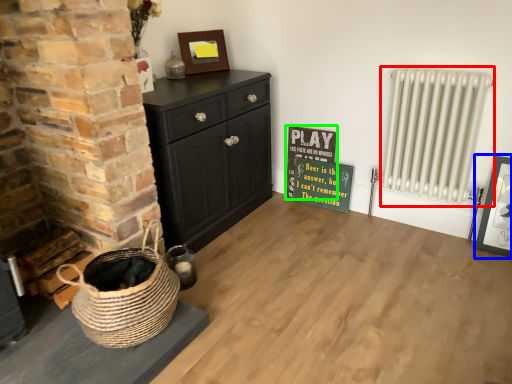
Question: Estimate the real-world distances between objects in this image. Which object is farther from radiator (highlighted by a red box), picture frame (highlighted by a blue box) or bulletin board (highlighted by a green box)?

Choices:
 (A) picture frame
 (B) bulletin board

Answer: (B)